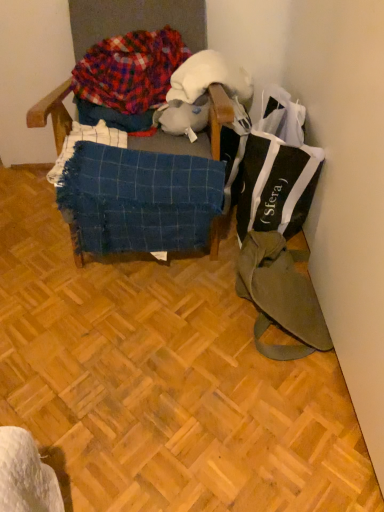
Question: Would you say black fabric bag at upper right is a long distance from wooden parquet floor at center?

Choices:
 (A) yes
 (B) no

Answer: (B)

Question: Can you confirm if black fabric bag at upper right is bigger than wooden parquet floor at center?

Choices:
 (A) yes
 (B) no

Answer: (B)

Question: Is black fabric bag at upper right closer to the viewer compared to wooden parquet floor at center?

Choices:
 (A) no
 (B) yes

Answer: (A)

Question: Is black fabric bag at upper right not within wooden parquet floor at center?

Choices:
 (A) no
 (B) yes

Answer: (B)

Question: Is black fabric bag at upper right with wooden parquet floor at center?

Choices:
 (A) yes
 (B) no

Answer: (B)

Question: Can you confirm if black fabric bag at upper right is shorter than wooden parquet floor at center?

Choices:
 (A) no
 (B) yes

Answer: (A)

Question: Is white plush toy at center looking in the opposite direction of wooden parquet floor at center?

Choices:
 (A) no
 (B) yes

Answer: (A)

Question: From a real-world perspective, is white plush toy at center beneath wooden parquet floor at center?

Choices:
 (A) no
 (B) yes

Answer: (A)

Question: From a real-world perspective, is white plush toy at center on top of wooden parquet floor at center?

Choices:
 (A) no
 (B) yes

Answer: (B)

Question: Can you confirm if white plush toy at center is smaller than wooden parquet floor at center?

Choices:
 (A) yes
 (B) no

Answer: (A)

Question: Considering the relative positions of white plush toy at center and wooden parquet floor at center in the image provided, is white plush toy at center to the right of wooden parquet floor at center from the viewer's perspective?

Choices:
 (A) yes
 (B) no

Answer: (A)

Question: Is white plush toy at center touching wooden parquet floor at center?

Choices:
 (A) no
 (B) yes

Answer: (A)

Question: Does wooden parquet floor at center have a smaller size compared to olive green canvas messenger bag at lower right?

Choices:
 (A) yes
 (B) no

Answer: (B)